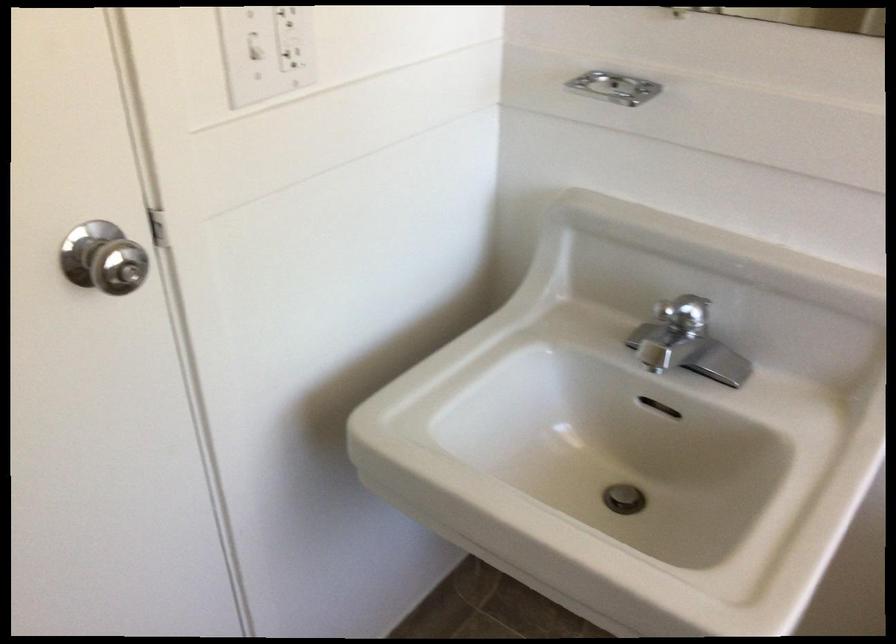
Where is `silver door knob`? This screenshot has height=644, width=896. silver door knob is located at coordinates (102, 259).